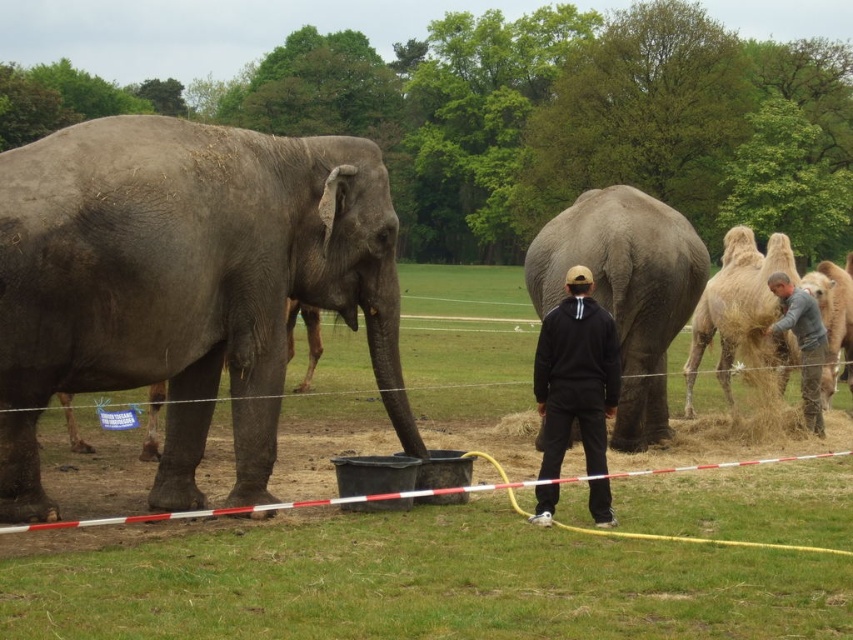
Question: Considering the real-world distances, which object is closest to the gray matte elephant at left?

Choices:
 (A) gray fabric pants at lower right
 (B) light brown textured camel at right
 (C) gray matte elephant at center
 (D) black hoodie at center

Answer: (D)

Question: Which of the following is the farthest from the observer?

Choices:
 (A) (399, 408)
 (B) (643, 246)
 (C) (552, 328)

Answer: (B)

Question: Can you confirm if gray matte elephant at left is positioned to the left of gray matte elephant at center?

Choices:
 (A) yes
 (B) no

Answer: (A)

Question: Does gray matte elephant at left appear over light brown textured camel at right?

Choices:
 (A) yes
 (B) no

Answer: (A)

Question: Estimate the real-world distances between objects in this image. Which object is closer to the gray matte elephant at left?

Choices:
 (A) gray fabric pants at lower right
 (B) gray matte elephant at center

Answer: (B)

Question: Is light brown textured camel at right to the right of gray fabric pants at lower right from the viewer's perspective?

Choices:
 (A) yes
 (B) no

Answer: (A)